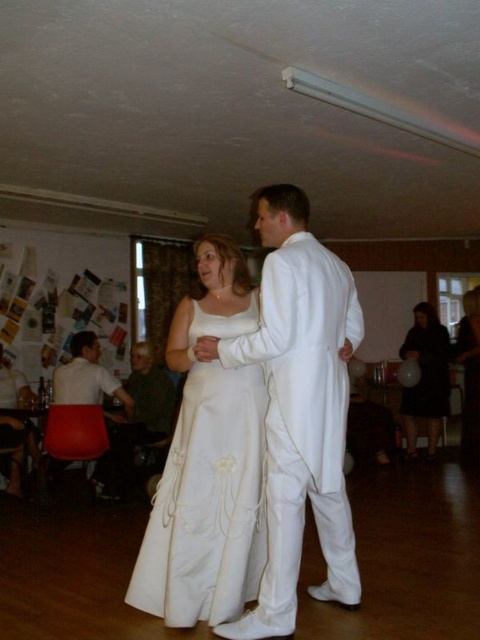
Who is positioned more to the left, satin white dress at center or white satin robe at center?

From the viewer's perspective, satin white dress at center appears more on the left side.

Which of these two, satin white dress at center or white satin robe at center, stands taller?

Standing taller between the two is white satin robe at center.

Find the location of `satin white dress at center`. satin white dress at center is located at coordinates (207, 461).

Can you confirm if satin white suit at center is wider than matte white chair at lower left?

Correct, the width of satin white suit at center exceeds that of matte white chair at lower left.

In the scene shown: Which is above, satin white suit at center or matte white chair at lower left?

satin white suit at center is higher up.

Image resolution: width=480 pixels, height=640 pixels. Identify the location of satin white suit at center. (300, 408).

Which of these two, satin white dress at center or black satin dress at lower right, stands taller?

With more height is black satin dress at lower right.

Is point (191, 484) positioned after point (431, 420)?

No, (191, 484) is closer to viewer.

Is point (233, 570) closer to camera compared to point (446, 348)?

Yes, it is.

Where is `satin white dress at center`? The width and height of the screenshot is (480, 640). satin white dress at center is located at coordinates (207, 461).